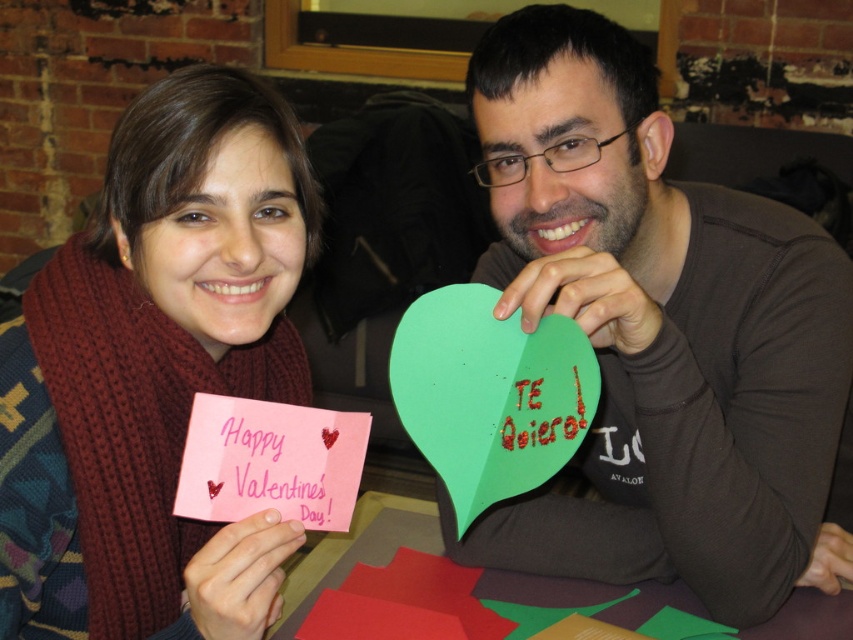
You are a photographer taking a picture of the scene. You notice the pink knitted scarf at left and the green paper heart at upper center. Which object is covering part of the other?

The pink knitted scarf at left is positioned over the green paper heart at upper center, so it is covering part of it.

You are a photographer trying to capture a closeup of both the pink knitted scarf at left and the green paper heart at upper center in the scene. Which object should you zoom in on first to ensure they both fit in the frame?

The pink knitted scarf at left is wider than the green paper heart at upper center, so you should zoom in on the pink knitted scarf at left first to ensure both objects fit in the frame.

You are a photographer trying to capture a clear shot of both the green paper heart at center and the green paper heart at upper center. Since you can only focus on one at a time, which one should you choose to ensure the other remains somewhat in focus?

The photographer should focus on the green paper heart at center because the green paper heart at upper center is behind it, so focusing on the closer object will keep the background one somewhat in focus.